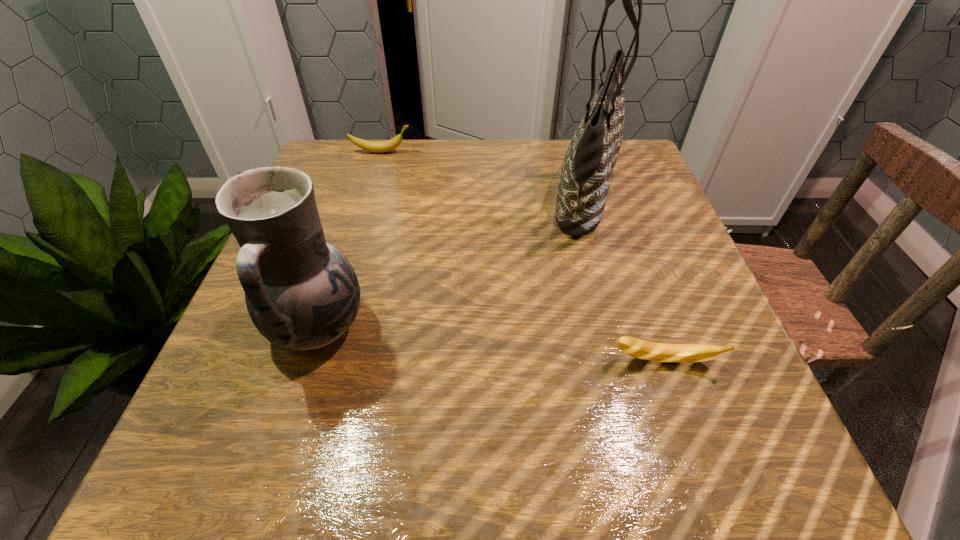
Find the location of `tote bag at the far edge`. tote bag at the far edge is located at coordinates (583, 187).

In order to click on banana that is at the far edge in this screenshot , I will do 372,146.

This screenshot has width=960, height=540. In order to click on pitcher situated at the left edge in this screenshot , I will do `click(301, 292)`.

The width and height of the screenshot is (960, 540). I want to click on banana at the left edge, so click(x=372, y=146).

Where is `tote bag situated at the right edge`? The height and width of the screenshot is (540, 960). tote bag situated at the right edge is located at coordinates (583, 187).

The width and height of the screenshot is (960, 540). Identify the location of banana that is at the right edge. (675, 353).

Locate an element on the screen. The image size is (960, 540). object positioned at the far left corner is located at coordinates (372, 146).

You are a GUI agent. You are given a task and a screenshot of the screen. Output one action in this format:
    pyautogui.click(x=<x>, y=<y>)
    Task: Click on the object positioned at the far right corner
    Image resolution: width=960 pixels, height=540 pixels.
    Given the screenshot: What is the action you would take?
    pyautogui.click(x=583, y=187)

Find the location of a particular element. The width and height of the screenshot is (960, 540). free space at the far edge of the desktop is located at coordinates (450, 184).

Find the location of a particular element. The height and width of the screenshot is (540, 960). vacant space at the left edge is located at coordinates (251, 355).